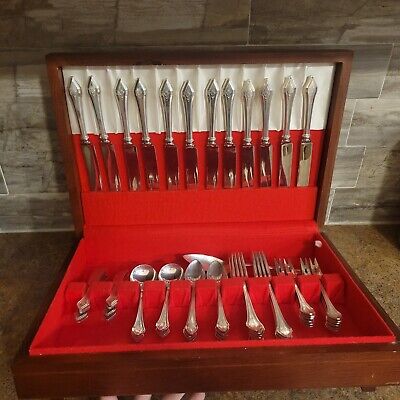
You are a GUI agent. You are given a task and a screenshot of the screen. Output one action in this format:
    pyautogui.click(x=<x>, y=<y>)
    Task: Click on the spoons or forks
    This screenshot has width=400, height=400.
    Given the screenshot: What is the action you would take?
    pyautogui.click(x=86, y=306), pyautogui.click(x=108, y=306), pyautogui.click(x=140, y=323), pyautogui.click(x=164, y=317), pyautogui.click(x=194, y=312), pyautogui.click(x=224, y=314), pyautogui.click(x=251, y=312), pyautogui.click(x=278, y=311), pyautogui.click(x=286, y=272), pyautogui.click(x=314, y=268)